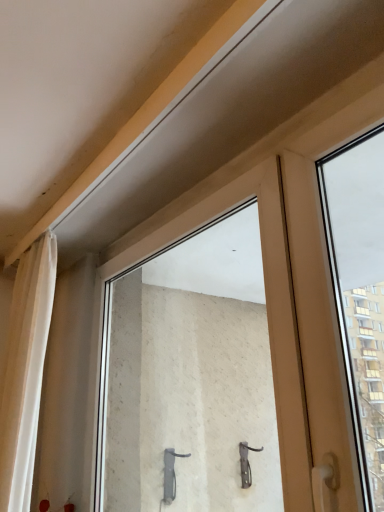
This screenshot has width=384, height=512. What are the coordinates of `empty space that is ontop of white sheer curtain at left (from a real-world perspective)` in the screenshot? It's located at (18, 224).